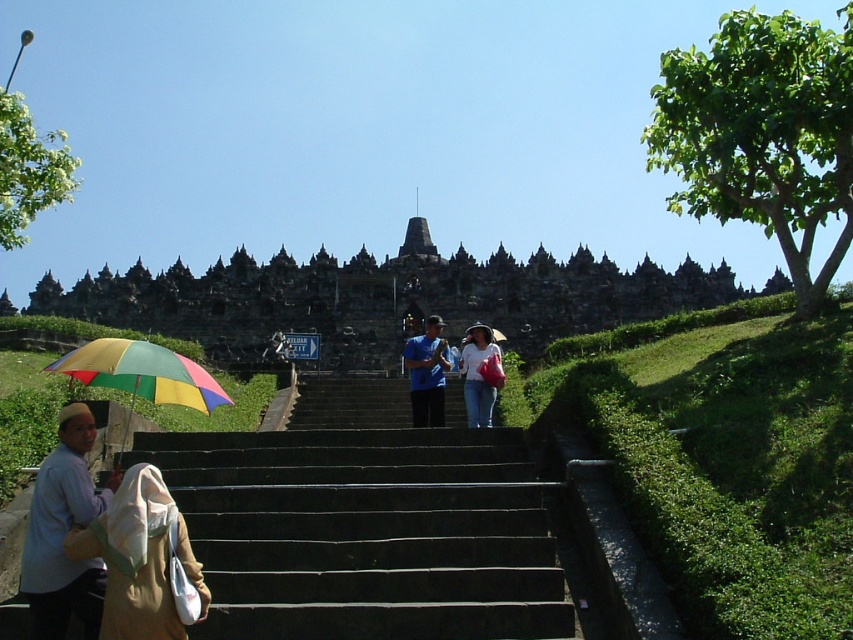
Between green grassy hill at lower right and dark gray stone temple at center, which one has less height?

Standing shorter between the two is green grassy hill at lower right.

Who is positioned more to the right, green grassy hill at lower right or dark gray stone temple at center?

From the viewer's perspective, green grassy hill at lower right appears more on the right side.

What do you see at coordinates (724, 458) in the screenshot?
I see `green grassy hill at lower right` at bounding box center [724, 458].

You are a GUI agent. You are given a task and a screenshot of the screen. Output one action in this format:
    pyautogui.click(x=<x>, y=<y>)
    Task: Click on the green grassy hill at lower right
    
    Given the screenshot: What is the action you would take?
    pyautogui.click(x=724, y=458)

How far apart are black stone stairs at center and rainbow fabric umbrella at center?

The distance of black stone stairs at center from rainbow fabric umbrella at center is 31.24 meters.

Between point (340, 545) and point (467, 328), which one is positioned in front?

Point (340, 545)

In order to click on black stone stairs at center in this screenshot , I will do `click(366, 524)`.

Based on the photo, between light brown fabric at lower left and denim jeans at center, which one is positioned higher?

denim jeans at center

I want to click on light brown fabric at lower left, so click(x=138, y=557).